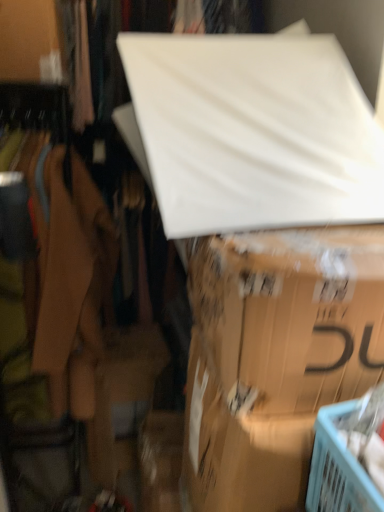
Question: Is white matte board at upper center next to matte cardboard box at center and touching it?

Choices:
 (A) no
 (B) yes

Answer: (A)

Question: Is matte cardboard box at center located within white matte board at upper center?

Choices:
 (A) no
 (B) yes

Answer: (A)

Question: Is white matte board at upper center taller than matte cardboard box at center?

Choices:
 (A) no
 (B) yes

Answer: (B)

Question: Can we say white matte board at upper center lies outside matte cardboard box at center?

Choices:
 (A) no
 (B) yes

Answer: (B)

Question: Does white matte board at upper center have a lesser width compared to matte cardboard box at center?

Choices:
 (A) no
 (B) yes

Answer: (B)

Question: Do you think white matte board at upper center is within matte cardboard box at center, or outside of it?

Choices:
 (A) inside
 (B) outside

Answer: (B)

Question: Is white matte board at upper center in front of or behind matte cardboard box at center in the image?

Choices:
 (A) front
 (B) behind

Answer: (B)

Question: Is white matte board at upper center wider or thinner than matte cardboard box at center?

Choices:
 (A) thin
 (B) wide

Answer: (A)

Question: Considering the relative positions of white matte board at upper center and matte cardboard box at center in the image provided, is white matte board at upper center to the left or to the right of matte cardboard box at center?

Choices:
 (A) left
 (B) right

Answer: (A)

Question: Based on their positions, is white matte board at upper center located to the left or right of white matte board at upper center?

Choices:
 (A) right
 (B) left

Answer: (A)

Question: Considering the positions of point (276, 142) and point (23, 12), is point (276, 142) closer or farther from the camera than point (23, 12)?

Choices:
 (A) closer
 (B) farther

Answer: (A)

Question: Considering their positions, is white matte board at upper center located in front of or behind white matte board at upper center?

Choices:
 (A) behind
 (B) front

Answer: (B)

Question: From a real-world perspective, relative to white matte board at upper center, is white matte board at upper center vertically above or below?

Choices:
 (A) above
 (B) below

Answer: (A)

Question: Is point (314, 53) positioned closer to the camera than point (231, 315)?

Choices:
 (A) farther
 (B) closer

Answer: (A)

Question: Considering the positions of white matte board at upper center and matte cardboard box at center in the image, is white matte board at upper center wider or thinner than matte cardboard box at center?

Choices:
 (A) thin
 (B) wide

Answer: (A)